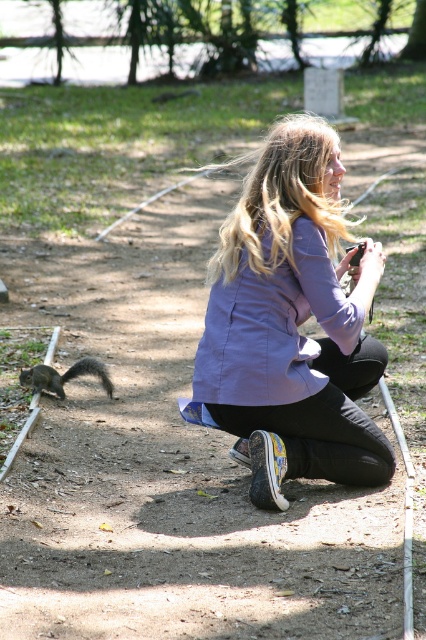
You are a photographer trying to capture the squirrel on the left. You notice a point at coordinates (293, 323). Where is this point located in relation to your purple matte jacket?

The point at coordinates (293, 323) is located on the purple matte jacket at center.

You are planning to take a photo of the purple matte jacket at center. Where should you position yourself relative to the jacket to ensure it is in the frame?

The purple matte jacket at center is located at point (x=293, y=323), so you should position yourself directly in front of it to capture it in the frame.